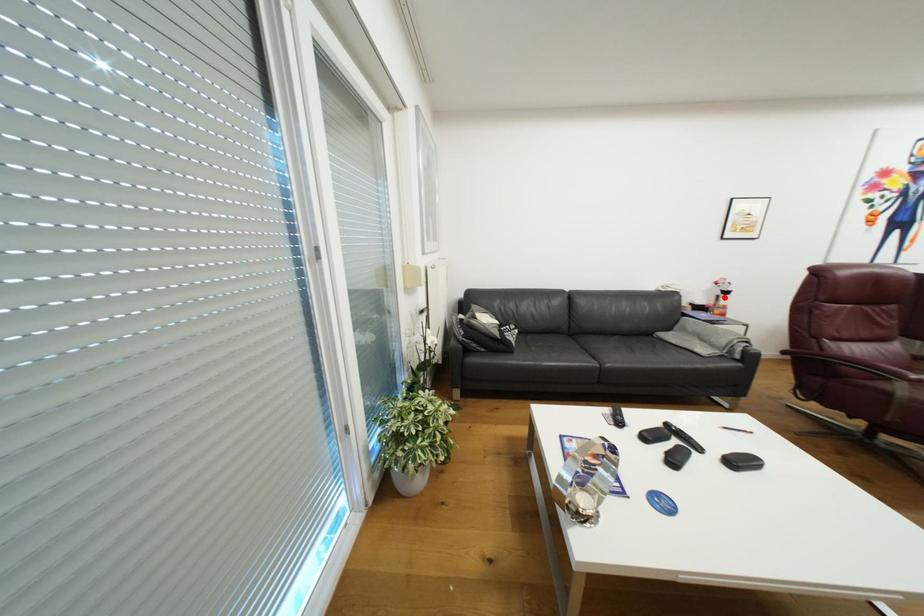
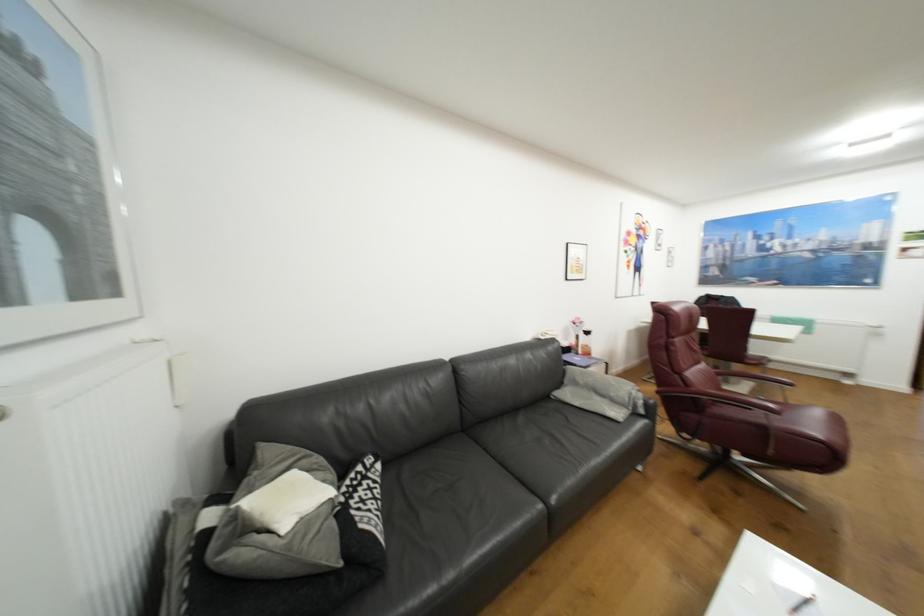
Question: I am providing you with two images of the same scene from different viewpoints. In image1, a red point is highlighted. Considering the same 3D point in image2, which of the following is correct?

Choices:
 (A) It is closer
 (B) It is farther

Answer: (B)